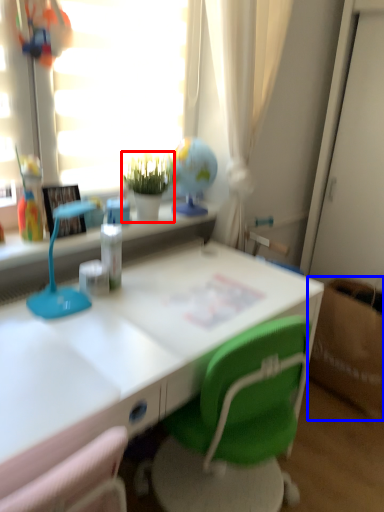
Question: Among these objects, which one is nearest to the camera, houseplant (highlighted by a red box) or cardboard box (highlighted by a blue box)?

Choices:
 (A) houseplant
 (B) cardboard box

Answer: (A)